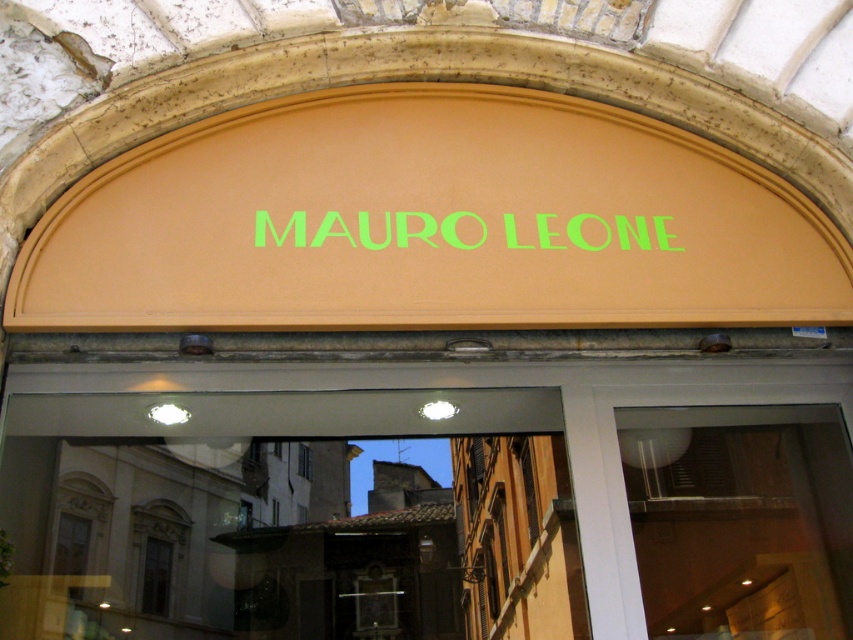
Between transparent glass door at center and green matte sign at center, which one appears on the left side from the viewer's perspective?

Positioned to the left is green matte sign at center.

Based on the photo, can you confirm if transparent glass door at center is positioned to the right of green matte sign at center?

Correct, you'll find transparent glass door at center to the right of green matte sign at center.

Where is `transparent glass door at center`? The width and height of the screenshot is (853, 640). transparent glass door at center is located at coordinates (740, 518).

This screenshot has height=640, width=853. I want to click on transparent glass door at center, so click(740, 518).